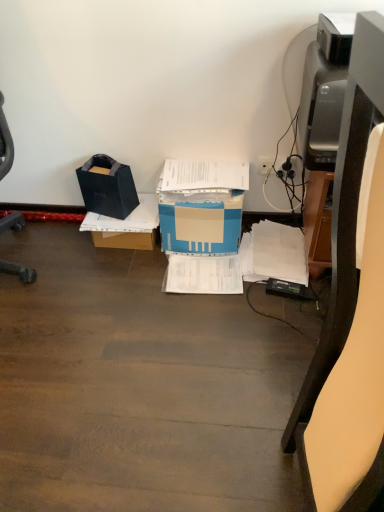
Locate an element on the screen. This screenshot has height=512, width=384. free space above white paper at center, acting as the 2th document starting from the right (from a real-world perspective) is located at coordinates (202, 272).